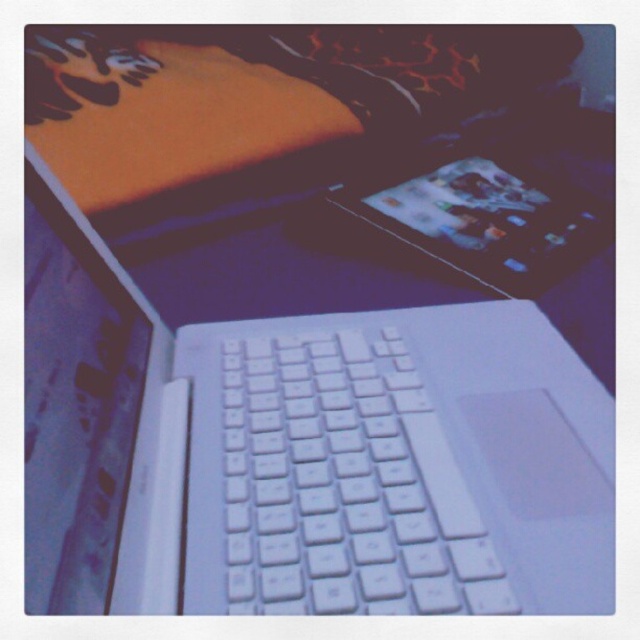
You are setting up a workspace and need to place both the white matte laptop at center and the metallic silver tablet at center on a shelf. If the shelf can only accommodate the width of the wider object, which device should you prioritize placing first?

The white matte laptop at center should be prioritized since its width surpasses that of the metallic silver tablet at center, ensuring it fits first before the shelf space is limited.